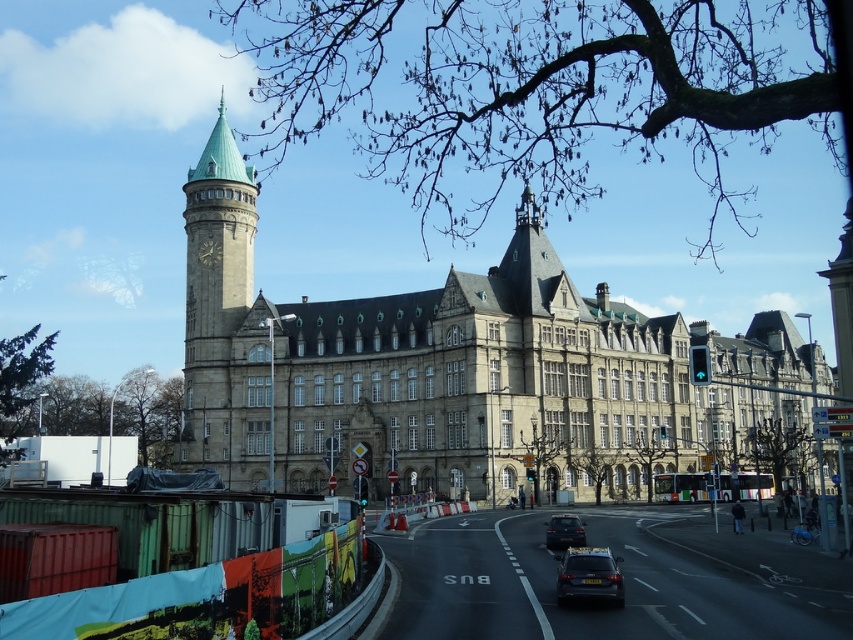
Is shiny black suv at lower center smaller than shiny black sedan at center?

Incorrect, shiny black suv at lower center is not smaller in size than shiny black sedan at center.

Is the position of shiny black suv at lower center less distant than that of shiny black sedan at center?

That is True.

Who is more forward, [598,577] or [566,522]?

Point [598,577] is in front.

This screenshot has height=640, width=853. I want to click on shiny black suv at lower center, so click(589, 576).

Which of these two, stone building at center or green copper bell tower at upper left, stands taller?

stone building at center is taller.

Between stone building at center and green copper bell tower at upper left, which one is positioned lower?

Positioned lower is stone building at center.

Which is behind, point (399, 330) or point (207, 305)?

The point (207, 305) is more distant.

This screenshot has height=640, width=853. Find the location of `stone building at center`. stone building at center is located at coordinates (426, 365).

Is point (619, 593) closer to camera compared to point (213, 253)?

That is True.

Locate an element on the screen. Image resolution: width=853 pixels, height=640 pixels. shiny black suv at lower center is located at coordinates (589, 576).

Locate an element on the screen. This screenshot has height=640, width=853. shiny black suv at lower center is located at coordinates (589, 576).